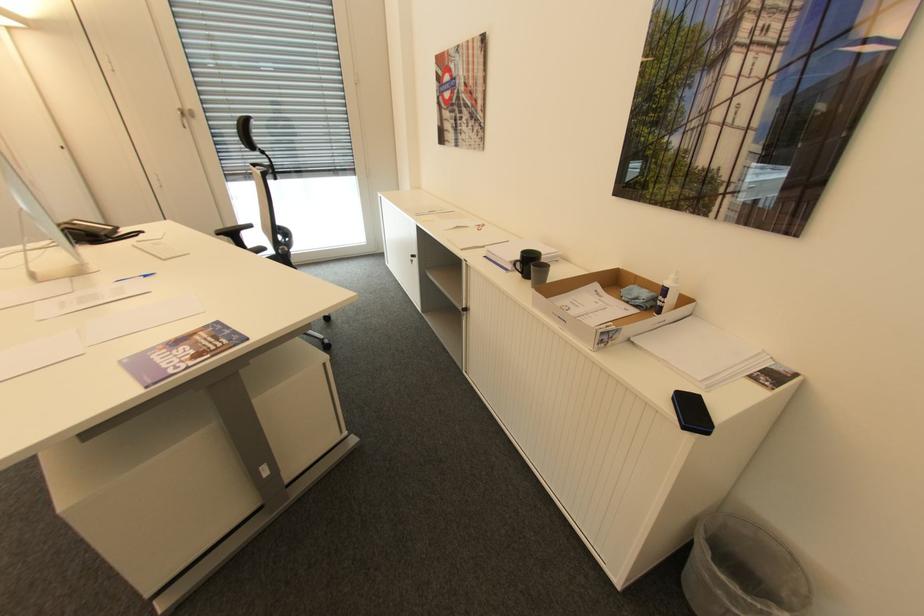
Find where to turn the cabinet door lock. Please return your answer as a coordinate pair (x, y).

(411, 257)